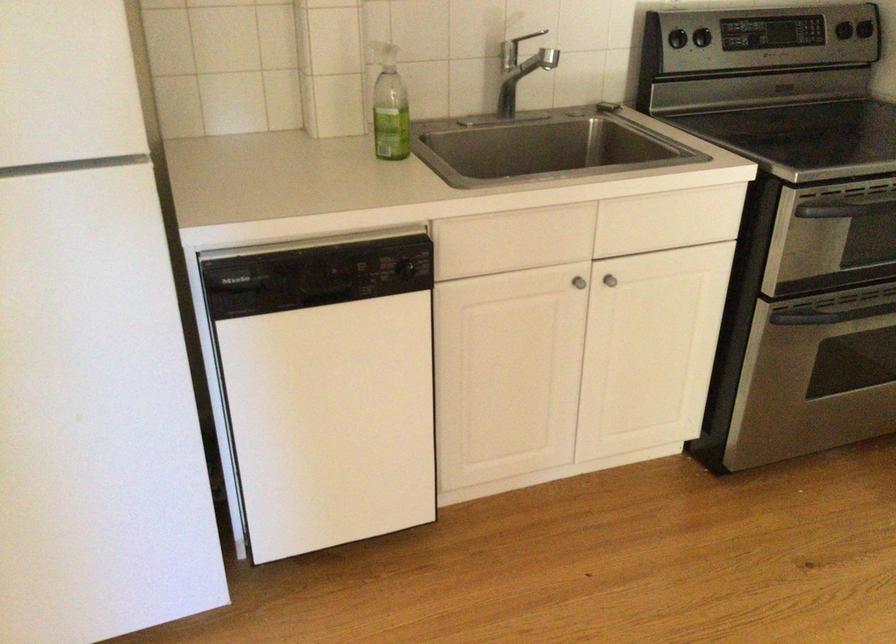
Locate an element on the screen. The height and width of the screenshot is (644, 896). faucet handle is located at coordinates (524, 41).